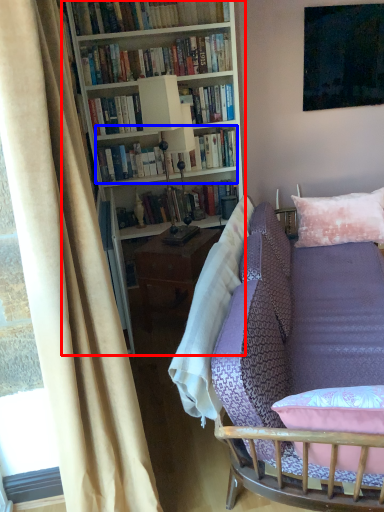
Question: Which point is further to the camera, bookcase (highlighted by a red box) or book (highlighted by a blue box)?

Choices:
 (A) bookcase
 (B) book

Answer: (B)